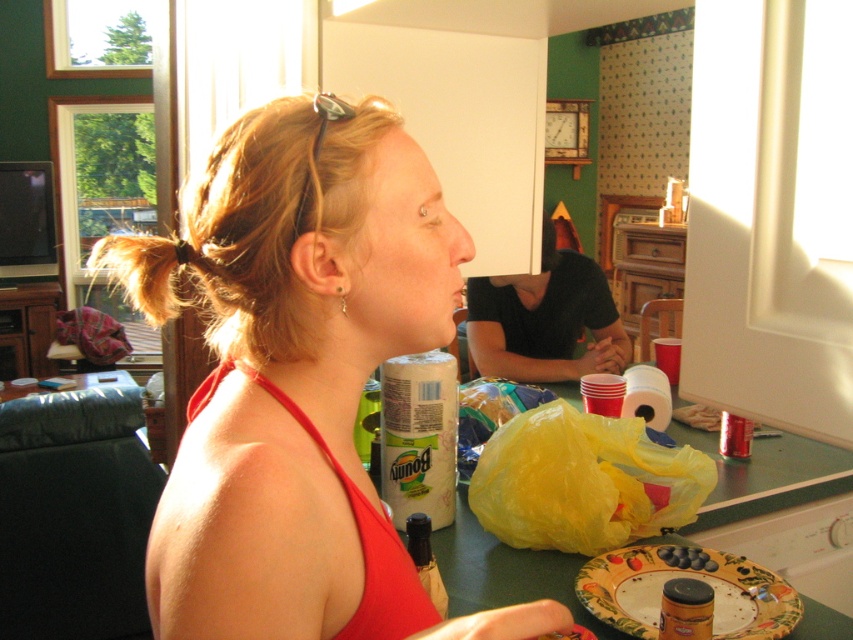
Does matte red bikini top at center appear over brown matte jar at lower right?

Indeed, matte red bikini top at center is positioned over brown matte jar at lower right.

Which is behind, point (218, 420) or point (683, 634)?

The point (683, 634) is more distant.

At what (x,y) coordinates should I click in order to perform the action: click on matte red bikini top at center. Please return your answer as a coordinate pair (x, y). This screenshot has width=853, height=640. Looking at the image, I should click on (299, 378).

Based on the photo, between white paper towel at center and brown matte jar at lower right, which one is positioned lower?

brown matte jar at lower right is lower down.

Is point (416, 416) positioned behind point (698, 604)?

Yes, it is behind point (698, 604).

This screenshot has height=640, width=853. What are the coordinates of `white paper towel at center` in the screenshot? It's located at (419, 435).

Is point (625, 556) in front of point (392, 438)?

Yes.

Who is more distant from viewer, (604,616) or (450,394)?

The point (450,394) is more distant.

The image size is (853, 640). In order to click on decorative ceramic plate with fruit design at lower right in this screenshot , I will do (686, 577).